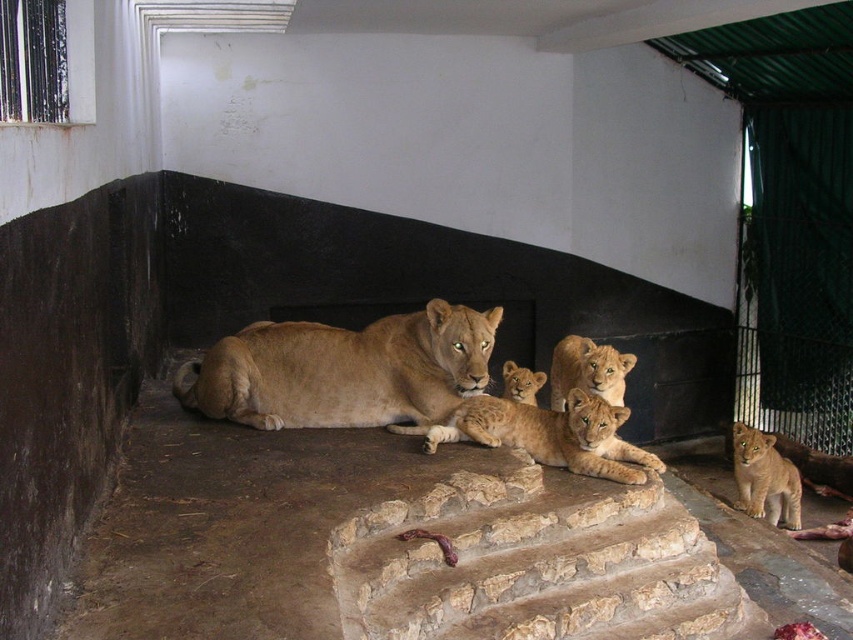
You are a zookeeper trying to locate the lioness in the enclosure. The lioness is at the center of the image. There is a specific point marked at coordinates point (x=344, y=371). Where is this point located on the lioness?

The point (x=344, y=371) is on the golden fur lion at center.

In the zoo enclosure, you see the golden fur lion cubs at center and the golden fur cub at lower right. Which group of cubs is positioned more to the left side of the enclosure?

The golden fur lion cubs at center are positioned more to the left side of the enclosure compared to the golden fur cub at lower right.